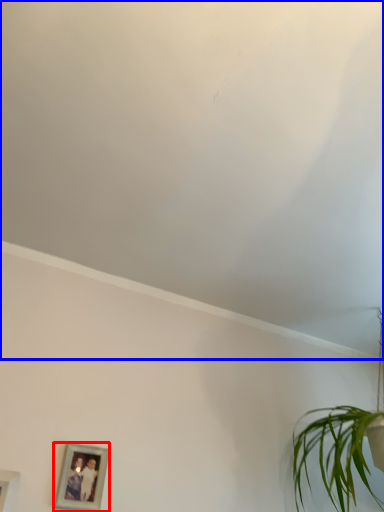
Question: Which of the following is the farthest to the observer, picture frame (highlighted by a red box) or cloud (highlighted by a blue box)?

Choices:
 (A) picture frame
 (B) cloud

Answer: (A)